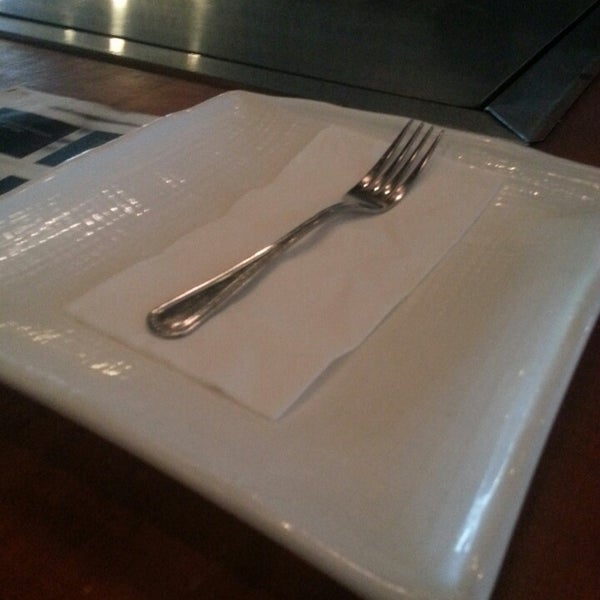
This screenshot has width=600, height=600. In order to click on green squares on napkin in this screenshot , I will do `click(9, 184)`, `click(74, 149)`, `click(27, 129)`.